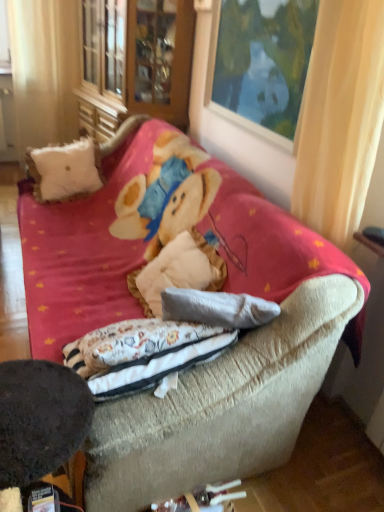
Question: Considering the relative positions of velvet beige couch at center and white fabric curtain at left, the second curtain from the front, in the image provided, is velvet beige couch at center to the left of white fabric curtain at left, the second curtain from the front, from the viewer's perspective?

Choices:
 (A) no
 (B) yes

Answer: (A)

Question: From a real-world perspective, is velvet beige couch at center physically above white fabric curtain at left, placed as the first curtain when sorted from back to front?

Choices:
 (A) no
 (B) yes

Answer: (A)

Question: Does velvet beige couch at center touch white fabric curtain at left, placed as the first curtain when sorted from top to bottom?

Choices:
 (A) no
 (B) yes

Answer: (A)

Question: Considering the relative sizes of velvet beige couch at center and white fabric curtain at left, the second curtain from the front, in the image provided, is velvet beige couch at center thinner than white fabric curtain at left, the second curtain from the front,?

Choices:
 (A) no
 (B) yes

Answer: (A)

Question: Is velvet beige couch at center in front of white fabric curtain at left, the first curtain positioned from the left?

Choices:
 (A) no
 (B) yes

Answer: (B)

Question: From the image's perspective, is velvet beige couch at center under white fabric curtain at left, the second curtain from the front?

Choices:
 (A) yes
 (B) no

Answer: (A)

Question: Is wooden cabinet at upper left positioned with its back to velvet beige couch at center?

Choices:
 (A) yes
 (B) no

Answer: (B)

Question: Would you say wooden cabinet at upper left is a long distance from velvet beige couch at center?

Choices:
 (A) no
 (B) yes

Answer: (A)

Question: Can you confirm if wooden cabinet at upper left is smaller than velvet beige couch at center?

Choices:
 (A) no
 (B) yes

Answer: (B)

Question: Considering the relative positions of wooden cabinet at upper left and velvet beige couch at center in the image provided, is wooden cabinet at upper left to the right of velvet beige couch at center from the viewer's perspective?

Choices:
 (A) yes
 (B) no

Answer: (B)

Question: From the image's perspective, is wooden cabinet at upper left below velvet beige couch at center?

Choices:
 (A) yes
 (B) no

Answer: (B)

Question: Does wooden cabinet at upper left come behind velvet beige couch at center?

Choices:
 (A) yes
 (B) no

Answer: (A)

Question: Does dark brown felt round table at lower left appear on the left side of wooden picture frame at upper center?

Choices:
 (A) no
 (B) yes

Answer: (B)